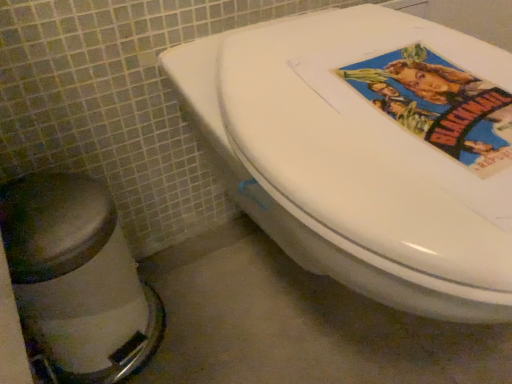
What is the approximate height of brushed metal bidet at lower left?

11.57 inches.

This screenshot has width=512, height=384. I want to click on brushed metal bidet at lower left, so click(77, 278).

This screenshot has height=384, width=512. What do you see at coordinates (77, 278) in the screenshot?
I see `brushed metal bidet at lower left` at bounding box center [77, 278].

In order to face white glossy toilet at center, should I rotate leftwards or rightwards?

Rotate your view right by about 14.173°.

Image resolution: width=512 pixels, height=384 pixels. What do you see at coordinates (367, 151) in the screenshot?
I see `white glossy toilet at center` at bounding box center [367, 151].

You are a GUI agent. You are given a task and a screenshot of the screen. Output one action in this format:
    pyautogui.click(x=<x>, y=<y>)
    Task: Click on the white glossy toilet at center
    The image size is (512, 384).
    Given the screenshot: What is the action you would take?
    pyautogui.click(x=367, y=151)

Identify the location of brushed metal bidet at lower left. The height and width of the screenshot is (384, 512). (77, 278).

In the scene shown: Is white glossy toilet at center to the left or to the right of brushed metal bidet at lower left in the image?

white glossy toilet at center is positioned on brushed metal bidet at lower left's right side.

Which is behind, white glossy toilet at center or brushed metal bidet at lower left?

brushed metal bidet at lower left is more distant.

Considering the positions of points (343, 37) and (146, 301), is point (343, 37) closer to camera compared to point (146, 301)?

Yes.

From the image's perspective, between white glossy toilet at center and brushed metal bidet at lower left, who is located below?

brushed metal bidet at lower left appears lower in the image.

From a real-world perspective, which object rests below the other?

brushed metal bidet at lower left, from a real-world perspective.

Considering the sizes of objects white glossy toilet at center and brushed metal bidet at lower left in the image provided, who is wider, white glossy toilet at center or brushed metal bidet at lower left?

Wider between the two is white glossy toilet at center.

Which of these two, white glossy toilet at center or brushed metal bidet at lower left, stands taller?

white glossy toilet at center.

Considering the sizes of white glossy toilet at center and brushed metal bidet at lower left in the image, is white glossy toilet at center bigger or smaller than brushed metal bidet at lower left?

Clearly, white glossy toilet at center is larger in size than brushed metal bidet at lower left.

Can we say white glossy toilet at center lies outside brushed metal bidet at lower left?

Yes, white glossy toilet at center is outside of brushed metal bidet at lower left.

Does white glossy toilet at center touch brushed metal bidet at lower left?

No, white glossy toilet at center is not in contact with brushed metal bidet at lower left.

Could you tell me if white glossy toilet at center is facing brushed metal bidet at lower left?

No, white glossy toilet at center is not oriented towards brushed metal bidet at lower left.

What's the angular difference between white glossy toilet at center and brushed metal bidet at lower left's facing directions?

There is a 0.184-degree angle between the facing directions of white glossy toilet at center and brushed metal bidet at lower left.

Measure the distance from white glossy toilet at center to brushed metal bidet at lower left.

white glossy toilet at center and brushed metal bidet at lower left are 12.46 inches apart from each other.

Where is `bidet lying below the white glossy toilet at center (from the image's perspective)`? This screenshot has height=384, width=512. bidet lying below the white glossy toilet at center (from the image's perspective) is located at coordinates 77,278.

Considering the relative positions of brushed metal bidet at lower left and white glossy toilet at center in the image provided, is brushed metal bidet at lower left to the left or to the right of white glossy toilet at center?

Clearly, brushed metal bidet at lower left is on the left of white glossy toilet at center in the image.

Which is in front, brushed metal bidet at lower left or white glossy toilet at center?

Positioned in front is white glossy toilet at center.

Which point is more forward, (16, 257) or (492, 72)?

Point (492, 72)

From the image's perspective, which is below, brushed metal bidet at lower left or white glossy toilet at center?

brushed metal bidet at lower left, from the image's perspective.

From a real-world perspective, is brushed metal bidet at lower left under white glossy toilet at center?

Yes, from a real-world perspective, brushed metal bidet at lower left is under white glossy toilet at center.

Is brushed metal bidet at lower left thinner than white glossy toilet at center?

Indeed, brushed metal bidet at lower left has a lesser width compared to white glossy toilet at center.

Who is taller, brushed metal bidet at lower left or white glossy toilet at center?

Standing taller between the two is white glossy toilet at center.

Is brushed metal bidet at lower left bigger than white glossy toilet at center?

No.

Is brushed metal bidet at lower left completely or partially outside of white glossy toilet at center?

Yes, brushed metal bidet at lower left is not within white glossy toilet at center.

Are brushed metal bidet at lower left and white glossy toilet at center far apart?

They are positioned close to each other.

Could you tell me if brushed metal bidet at lower left is facing white glossy toilet at center?

No, brushed metal bidet at lower left is not oriented towards white glossy toilet at center.

You are a GUI agent. You are given a task and a screenshot of the screen. Output one action in this format:
    pyautogui.click(x=<x>, y=<y>)
    Task: Click on the bidet behind the white glossy toilet at center
    This screenshot has height=384, width=512.
    Given the screenshot: What is the action you would take?
    pyautogui.click(x=77, y=278)

The height and width of the screenshot is (384, 512). Find the location of `bidet directly beneath the white glossy toilet at center (from a real-world perspective)`. bidet directly beneath the white glossy toilet at center (from a real-world perspective) is located at coordinates (77, 278).

Where is `bidet below the white glossy toilet at center (from the image's perspective)`? bidet below the white glossy toilet at center (from the image's perspective) is located at coordinates (77, 278).